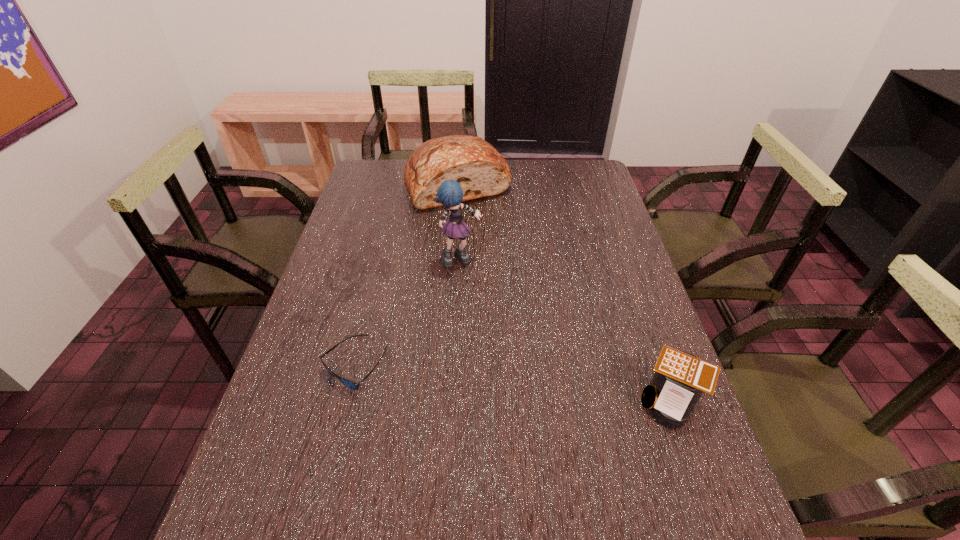
The image size is (960, 540). Find the location of `free spot between the sunglasses and the third tallest object`. free spot between the sunglasses and the third tallest object is located at coordinates (514, 383).

Where is `object that is the third closest to the shortest object`? The image size is (960, 540). object that is the third closest to the shortest object is located at coordinates (680, 378).

Locate an element on the screen. the third closest object relative to the calculator is located at coordinates (476, 165).

Where is `free location that satisfies the following two spatial constraints: 1. on the front side of the calculator; 2. on the left side of the second tallest object`? The width and height of the screenshot is (960, 540). free location that satisfies the following two spatial constraints: 1. on the front side of the calculator; 2. on the left side of the second tallest object is located at coordinates (443, 400).

Find the location of `free space that satisfies the following two spatial constraints: 1. on the front side of the bread; 2. on the left side of the third nearest object`. free space that satisfies the following two spatial constraints: 1. on the front side of the bread; 2. on the left side of the third nearest object is located at coordinates (452, 260).

Find the location of `vacant point that satisfies the following two spatial constraints: 1. on the front side of the rag doll; 2. on the left side of the farthest object`. vacant point that satisfies the following two spatial constraints: 1. on the front side of the rag doll; 2. on the left side of the farthest object is located at coordinates (452, 260).